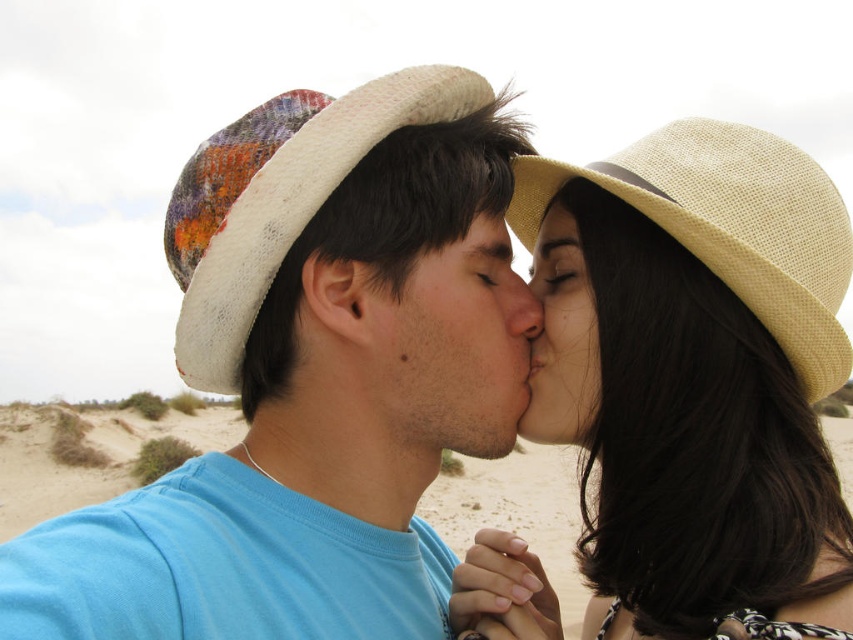
Between point (199, 154) and point (555, 216), which one is positioned behind?

The point (555, 216) is behind.

Can you confirm if white woven cowboy hat at center is positioned below matte beige hat at upper center?

No, white woven cowboy hat at center is not below matte beige hat at upper center.

Is point (173, 250) farther from viewer compared to point (558, 204)?

That is False.

This screenshot has width=853, height=640. Identify the location of white woven cowboy hat at center. (277, 198).

Does point (526, 387) come closer to viewer compared to point (529, 269)?

Yes, point (526, 387) is closer to viewer.

Which is in front, point (456, 294) or point (537, 310)?

Point (456, 294) is in front.

Is point (392, 307) farther from camera compared to point (514, 333)?

No, (392, 307) is in front of (514, 333).

Where is `smooth skin face at center`? The height and width of the screenshot is (640, 853). smooth skin face at center is located at coordinates (456, 346).

Who is higher up, white woven cowboy hat at center or matte beige hat at center?

white woven cowboy hat at center is higher up.

Between white woven cowboy hat at center and matte beige hat at center, which one appears on the right side from the viewer's perspective?

matte beige hat at center is more to the right.

Find the location of a particular element. white woven cowboy hat at center is located at coordinates (277, 198).